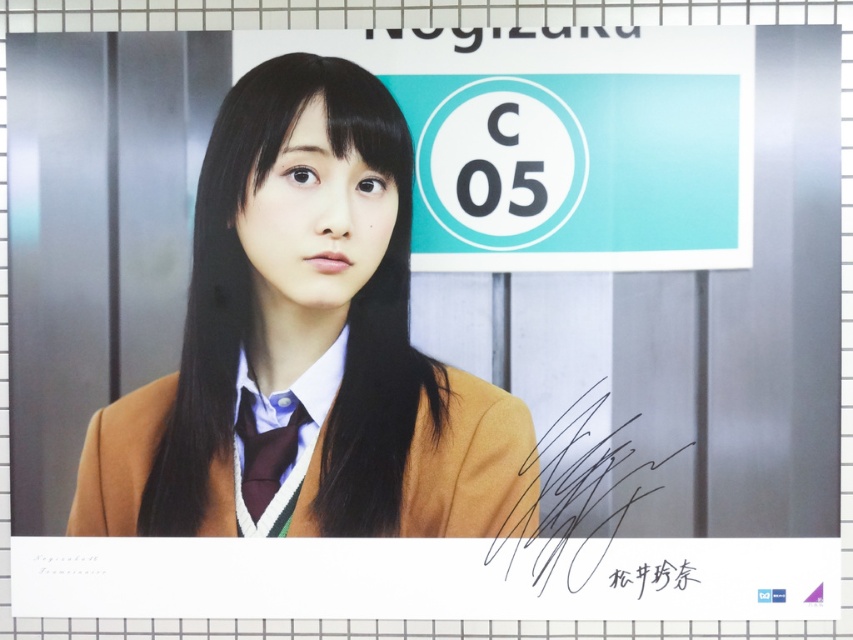
You are an artist trying to sketch this scene. You notice the brown woolen sweater at center and the black ink signature at lower right. Which object should you draw first if you want to focus on the larger one?

The brown woolen sweater at center should be drawn first because its width is larger than the black ink signature at lower right.

You are an artist trying to sketch the scene. You notice the maroon satin tie at center and the black ink signature at center. Which object should you draw first if you want to focus on the larger one?

You should draw the maroon satin tie at center first because it has a larger size compared to the black ink signature at center.

You are an art student analyzing a portrait. You notice the brown woolen sweater at center and the black ink signature at lower right. Based on their positions in the image, which object is closer to the top of the portrait?

The brown woolen sweater at center is located above the black ink signature at lower right, so it is closer to the top of the portrait.